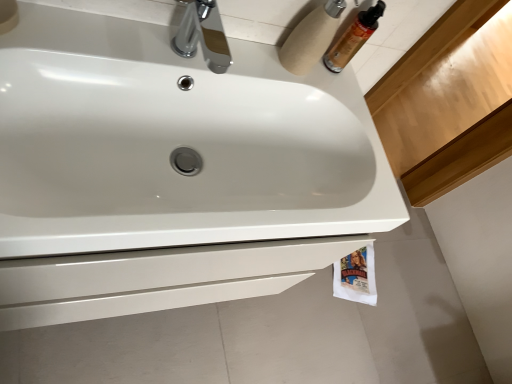
Where is `vacant space situated above white paper towel at lower right, arranged as the second toilet paper when viewed from the top (from a real-world perspective)`? The height and width of the screenshot is (384, 512). vacant space situated above white paper towel at lower right, arranged as the second toilet paper when viewed from the top (from a real-world perspective) is located at coordinates (361, 268).